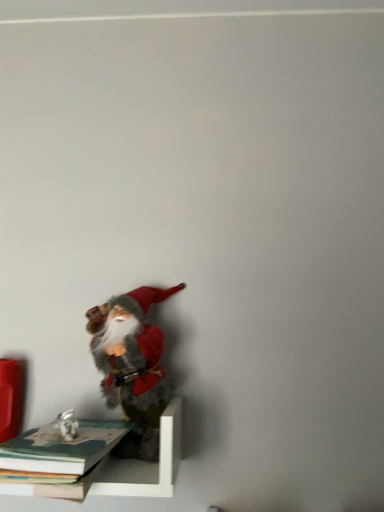
Question: Is white matte shelf at lower left oriented towards hardcover book at lower left, which is the second book from top to bottom?

Choices:
 (A) no
 (B) yes

Answer: (B)

Question: Does white matte shelf at lower left lie behind hardcover book at lower left, positioned as the first book in bottom-to-top order?

Choices:
 (A) yes
 (B) no

Answer: (A)

Question: Does white matte shelf at lower left appear on the right side of hardcover book at lower left, which is the second book from top to bottom?

Choices:
 (A) no
 (B) yes

Answer: (B)

Question: Considering the relative sizes of white matte shelf at lower left and hardcover book at lower left, positioned as the first book in bottom-to-top order, in the image provided, is white matte shelf at lower left shorter than hardcover book at lower left, positioned as the first book in bottom-to-top order,?

Choices:
 (A) no
 (B) yes

Answer: (A)

Question: Is white matte shelf at lower left positioned far away from hardcover book at lower left, positioned as the first book in bottom-to-top order?

Choices:
 (A) yes
 (B) no

Answer: (B)

Question: Is white matte shelf at lower left turned away from hardcover book at lower left, which is the second book from top to bottom?

Choices:
 (A) yes
 (B) no

Answer: (A)

Question: Is fuzzy felt santa at lower left thinner than hardcover book at lower left, which appears as the second book when ordered from the bottom?

Choices:
 (A) no
 (B) yes

Answer: (B)

Question: Is fuzzy felt santa at lower left positioned with its back to hardcover book at lower left, which appears as the second book when ordered from the bottom?

Choices:
 (A) yes
 (B) no

Answer: (B)

Question: Is hardcover book at lower left, which appears as the second book when ordered from the bottom, a part of fuzzy felt santa at lower left?

Choices:
 (A) no
 (B) yes

Answer: (A)

Question: Is fuzzy felt santa at lower left shorter than hardcover book at lower left, which appears as the second book when ordered from the bottom?

Choices:
 (A) yes
 (B) no

Answer: (B)

Question: From the image's perspective, is fuzzy felt santa at lower left above hardcover book at lower left, which ranks as the 1th book in top-to-bottom order?

Choices:
 (A) yes
 (B) no

Answer: (A)

Question: From the image's perspective, is fuzzy felt santa at lower left under hardcover book at lower left, which ranks as the 1th book in top-to-bottom order?

Choices:
 (A) yes
 (B) no

Answer: (B)

Question: Is fuzzy felt santa at lower left bigger than hardcover book at lower left, positioned as the first book in bottom-to-top order?

Choices:
 (A) yes
 (B) no

Answer: (A)